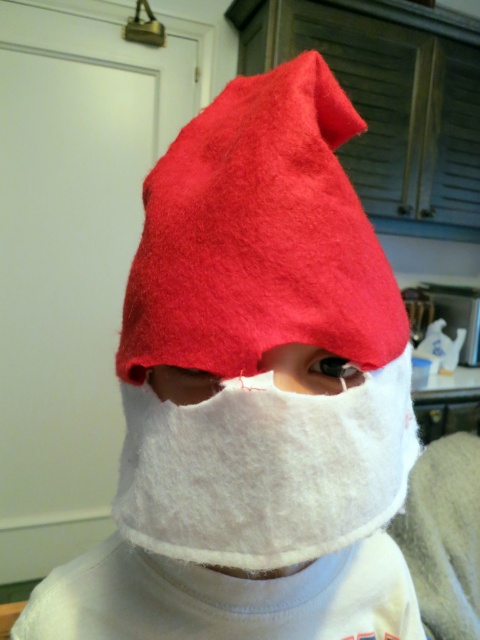
Question: Is matte felt hat at upper center smaller than white felt mask at center?

Choices:
 (A) no
 (B) yes

Answer: (A)

Question: From the image, what is the correct spatial relationship of matte felt hat at upper center in relation to white soft fabric at center?

Choices:
 (A) right
 (B) left

Answer: (A)

Question: Which point is closer to the camera?

Choices:
 (A) white soft fabric at center
 (B) matte felt hat at upper center

Answer: (B)

Question: Among these objects, which one is farthest from the camera?

Choices:
 (A) matte felt hat at upper center
 (B) white felt mask at center
 (C) white soft fabric at center

Answer: (C)

Question: Which object is closer to the camera taking this photo?

Choices:
 (A) matte felt hat at upper center
 (B) white felt mask at center
 (C) white soft fabric at center

Answer: (B)

Question: Can you confirm if matte felt hat at upper center is positioned above white felt mask at center?

Choices:
 (A) no
 (B) yes

Answer: (B)